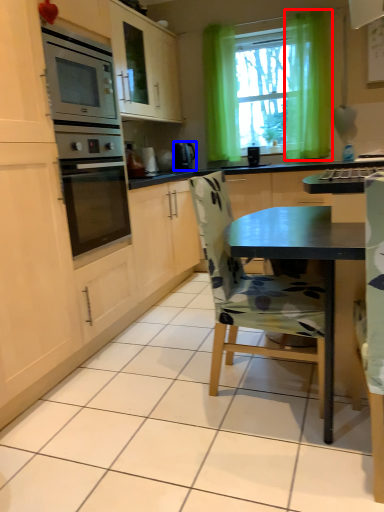
Question: Which object is further to the camera taking this photo, curtain (highlighted by a red box) or kitchen appliance (highlighted by a blue box)?

Choices:
 (A) curtain
 (B) kitchen appliance

Answer: (B)